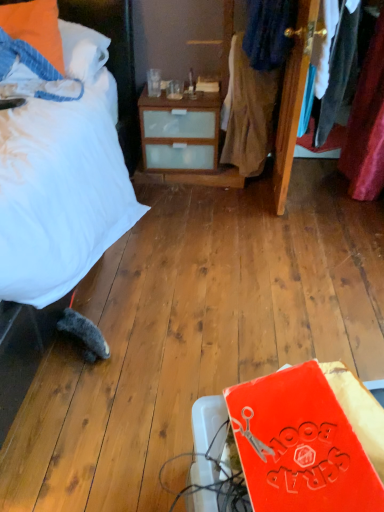
Question: Is denim jacket at upper right, which is the first clothing from top to bottom, completely or partially outside of orange fabric pillow at upper left?

Choices:
 (A) yes
 (B) no

Answer: (A)

Question: From a real-world perspective, does denim jacket at upper right, acting as the 2th clothing starting from the bottom, stand above orange fabric pillow at upper left?

Choices:
 (A) no
 (B) yes

Answer: (A)

Question: From the image's perspective, is denim jacket at upper right, which is the first clothing from top to bottom, located above orange fabric pillow at upper left?

Choices:
 (A) yes
 (B) no

Answer: (A)

Question: Are denim jacket at upper right, which is the first clothing from top to bottom, and orange fabric pillow at upper left beside each other?

Choices:
 (A) yes
 (B) no

Answer: (B)

Question: Can you confirm if denim jacket at upper right, acting as the 2th clothing starting from the bottom, is shorter than orange fabric pillow at upper left?

Choices:
 (A) yes
 (B) no

Answer: (B)

Question: Is rubberized orange book at lower right wider or thinner than dark blue fabric at upper right, the second clothing from the top?

Choices:
 (A) wide
 (B) thin

Answer: (B)

Question: From their relative heights in the image, would you say rubberized orange book at lower right is taller or shorter than dark blue fabric at upper right, the second clothing from the top?

Choices:
 (A) tall
 (B) short

Answer: (B)

Question: Is rubberized orange book at lower right in front of or behind dark blue fabric at upper right, which ranks as the 1th clothing in bottom-to-top order, in the image?

Choices:
 (A) front
 (B) behind

Answer: (A)

Question: Is rubberized orange book at lower right bigger or smaller than dark blue fabric at upper right, the second clothing from the top?

Choices:
 (A) small
 (B) big

Answer: (A)

Question: Does point (271, 51) appear closer or farther from the camera than point (31, 30)?

Choices:
 (A) farther
 (B) closer

Answer: (A)

Question: In the image, is denim jacket at upper right, acting as the 2th clothing starting from the bottom, positioned in front of or behind orange fabric pillow at upper left?

Choices:
 (A) front
 (B) behind

Answer: (B)

Question: Visually, is denim jacket at upper right, which is the first clothing from top to bottom, positioned to the left or to the right of orange fabric pillow at upper left?

Choices:
 (A) right
 (B) left

Answer: (A)

Question: Considering the positions of denim jacket at upper right, acting as the 2th clothing starting from the bottom, and orange fabric pillow at upper left in the image, is denim jacket at upper right, acting as the 2th clothing starting from the bottom, wider or thinner than orange fabric pillow at upper left?

Choices:
 (A) thin
 (B) wide

Answer: (B)

Question: From the image's perspective, is orange fabric pillow at upper left positioned above or below dark blue fabric at upper right, which ranks as the 1th clothing in bottom-to-top order?

Choices:
 (A) below
 (B) above

Answer: (B)

Question: From a real-world perspective, is orange fabric pillow at upper left positioned above or below dark blue fabric at upper right, which ranks as the 1th clothing in bottom-to-top order?

Choices:
 (A) above
 (B) below

Answer: (A)